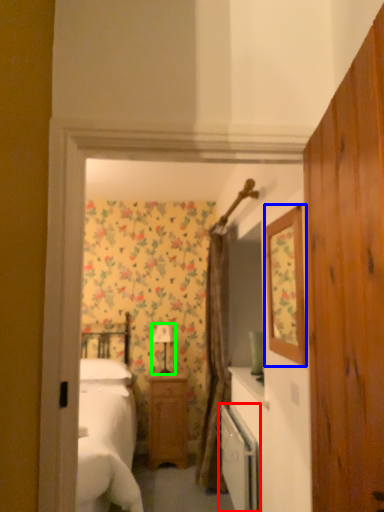
Question: Which object is positioned closest to dish washer (highlighted by a red box)? Select from mirror (highlighted by a blue box) and lamp (highlighted by a green box).

Choices:
 (A) mirror
 (B) lamp

Answer: (A)